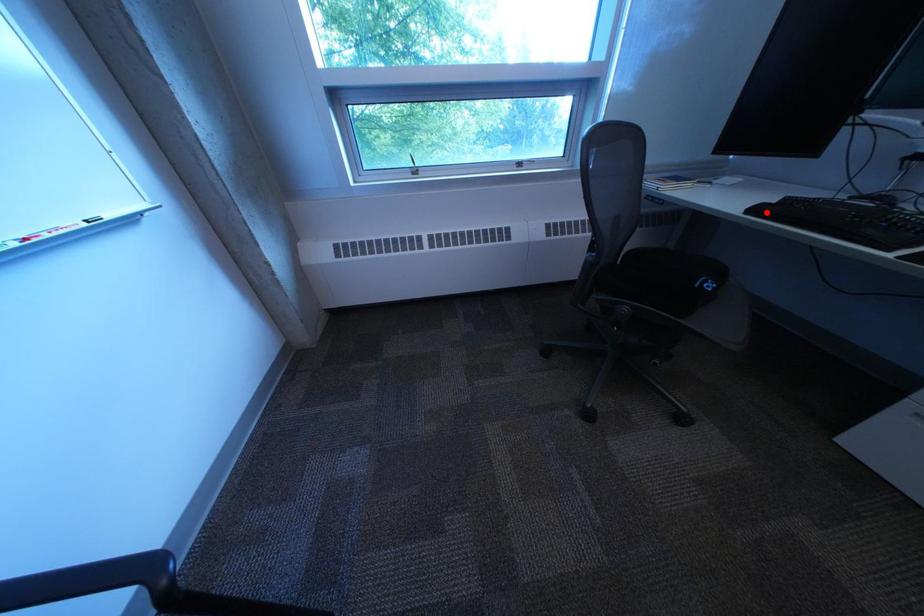
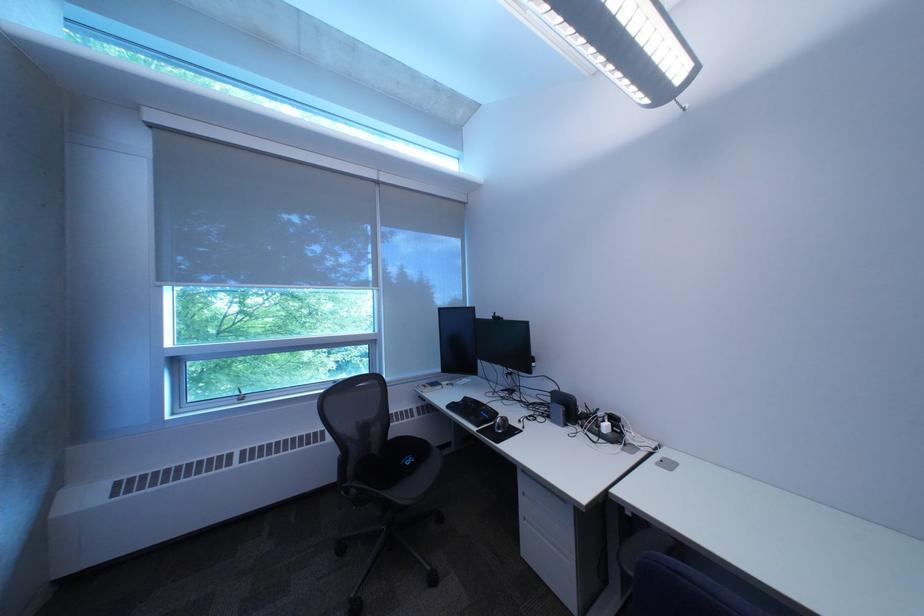
The point at the highlighted location is marked in the first image. Where is the corresponding point in the second image?

(464, 408)